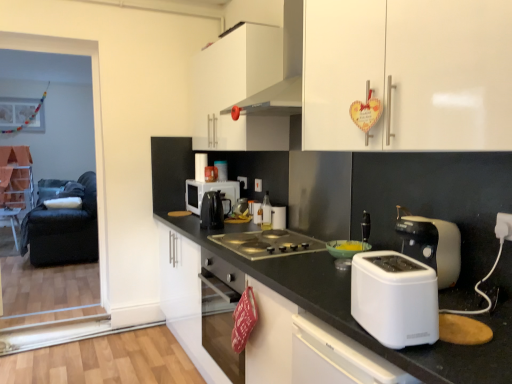
The height and width of the screenshot is (384, 512). I want to click on vacant area located to the right-hand side of white plastic toaster at lower right, which is the 2th toaster from right to left, so click(463, 316).